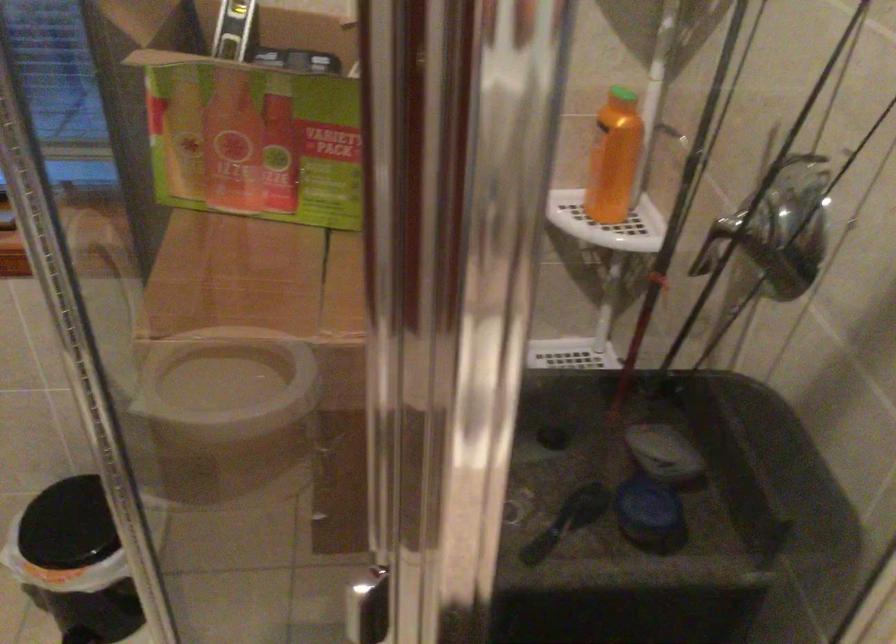
Where is `blue container lid`? blue container lid is located at coordinates (650, 515).